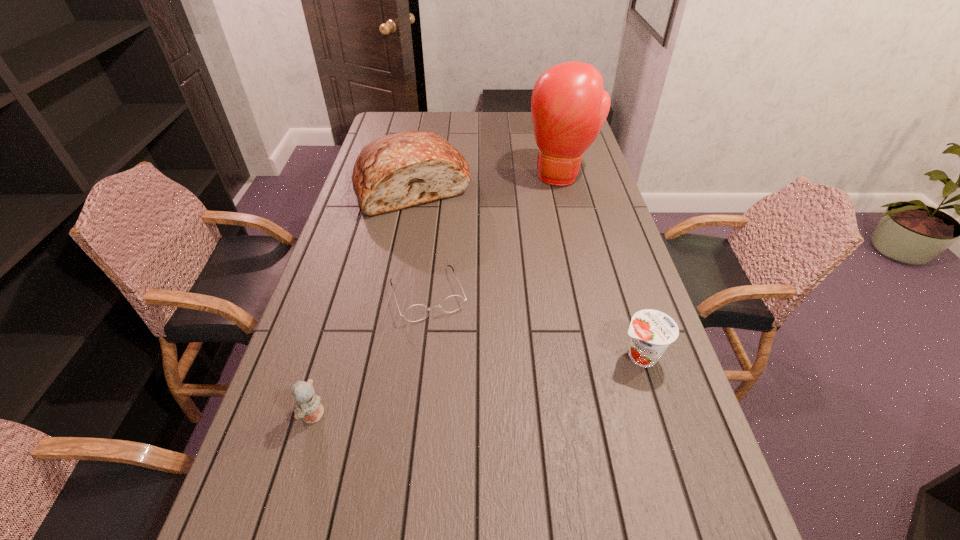
At what (x,y) coordinates should I click in order to perform the action: click on vacant space at the far edge. Please return your answer as a coordinate pair (x, y). Looking at the image, I should click on (465, 135).

Identify the location of vacant space at the near edge. (540, 502).

This screenshot has height=540, width=960. In the image, there is a desktop. What are the coordinates of `vacant space at the left edge` in the screenshot? It's located at (366, 311).

Locate an element on the screen. This screenshot has width=960, height=540. vacant region at the right edge is located at coordinates (587, 176).

Where is `blank area at the far left corner`? This screenshot has height=540, width=960. blank area at the far left corner is located at coordinates (396, 126).

Where is `vacant space in between the fourth farthest object and the third farthest object`? vacant space in between the fourth farthest object and the third farthest object is located at coordinates (534, 325).

Find the location of `vacant space that's between the tallest object and the yogurt`. vacant space that's between the tallest object and the yogurt is located at coordinates (601, 266).

Locate an element on the screen. This screenshot has width=960, height=540. free space between the teddy bear and the yogurt is located at coordinates (476, 386).

Locate an element on the screen. free spot between the third nearest object and the fourth shortest object is located at coordinates (420, 240).

Identify the location of vacant space that is in between the shortest object and the second tallest object. This screenshot has width=960, height=540. (420, 240).